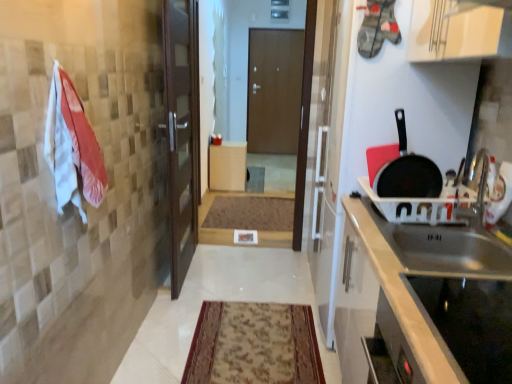
Question: Is white cotton towel at left in front of or behind black matte frying pan at right in the image?

Choices:
 (A) front
 (B) behind

Answer: (A)

Question: In terms of height, does white cotton towel at left look taller or shorter compared to black matte frying pan at right?

Choices:
 (A) short
 (B) tall

Answer: (B)

Question: Which is farther from the carpeted rug at center, the 1th mat from the front?

Choices:
 (A) stainless steel sink at right
 (B) black glass cooktop at lower right
 (C) brown matte door at center
 (D) white matte cabinet at center
 (E) white cotton towel at left

Answer: (C)

Question: Estimate the real-world distances between objects in this image. Which object is closer to the carpeted rug at center, placed as the second mat when sorted from back to front?

Choices:
 (A) white matte cabinet at center
 (B) brown matte door at center
 (C) black matte frying pan at right
 (D) black glass cooktop at lower right
 (E) stainless steel sink at right

Answer: (E)